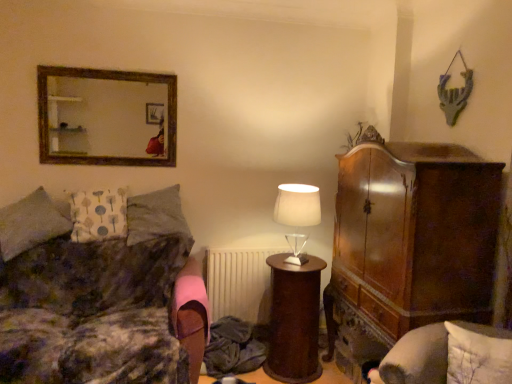
Question: Is velvet-like brown couch at left to the right of wooden frame mirror at upper left from the viewer's perspective?

Choices:
 (A) yes
 (B) no

Answer: (A)

Question: Does velvet-like brown couch at left have a greater height compared to wooden frame mirror at upper left?

Choices:
 (A) yes
 (B) no

Answer: (A)

Question: Are velvet-like brown couch at left and wooden frame mirror at upper left beside each other?

Choices:
 (A) no
 (B) yes

Answer: (A)

Question: Considering the relative sizes of velvet-like brown couch at left and wooden frame mirror at upper left in the image provided, is velvet-like brown couch at left smaller than wooden frame mirror at upper left?

Choices:
 (A) no
 (B) yes

Answer: (A)

Question: Would you say velvet-like brown couch at left contains wooden frame mirror at upper left?

Choices:
 (A) yes
 (B) no

Answer: (B)

Question: Relative to white matte radiator at center, is brown polished wood side table at center in front or behind?

Choices:
 (A) behind
 (B) front

Answer: (B)

Question: Is brown polished wood side table at center to the left or to the right of white matte radiator at center in the image?

Choices:
 (A) right
 (B) left

Answer: (A)

Question: Is point (296, 337) positioned closer to the camera than point (267, 256)?

Choices:
 (A) farther
 (B) closer

Answer: (B)

Question: From the image's perspective, relative to white matte radiator at center, is brown polished wood side table at center above or below?

Choices:
 (A) below
 (B) above

Answer: (A)

Question: Would you say wooden frame mirror at upper left is to the left or to the right of gray fabric pillow at left, the 2th pillow positioned from the right, in the picture?

Choices:
 (A) right
 (B) left

Answer: (B)

Question: From a real-world perspective, is wooden frame mirror at upper left physically located above or below gray fabric pillow at left, the 2th pillow positioned from the right?

Choices:
 (A) below
 (B) above

Answer: (B)

Question: Based on their sizes in the image, would you say wooden frame mirror at upper left is bigger or smaller than gray fabric pillow at left, acting as the 3th pillow starting from the left?

Choices:
 (A) big
 (B) small

Answer: (B)

Question: Is wooden frame mirror at upper left situated inside gray fabric pillow at left, acting as the 3th pillow starting from the left, or outside?

Choices:
 (A) outside
 (B) inside

Answer: (A)

Question: From their relative heights in the image, would you say white fabric pillow at left, the 1th pillow from the left, is taller or shorter than brown polished wood side table at center?

Choices:
 (A) short
 (B) tall

Answer: (A)

Question: Is white fabric pillow at left, the 1th pillow from the left, inside or outside of brown polished wood side table at center?

Choices:
 (A) outside
 (B) inside

Answer: (A)